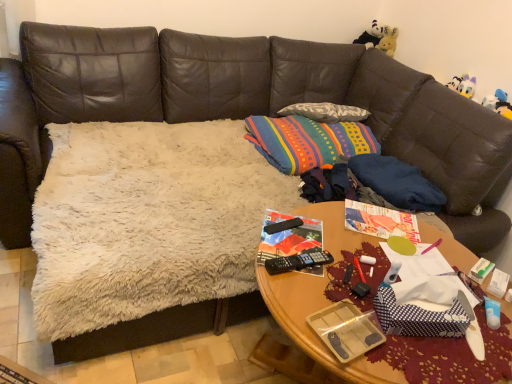
In order to face blue dotted paper at center, should I rotate leftwards or rightwards?

You should rotate right by 21.763 degrees.

Image resolution: width=512 pixels, height=384 pixels. I want to click on multicolored woven throw pillow at center, so click(x=307, y=141).

Between clear plastic tray at center and blue dotted paper at center, which one has smaller size?

Smaller between the two is clear plastic tray at center.

Which is behind, clear plastic tray at center or blue dotted paper at center?

blue dotted paper at center is more distant.

Looking at this image, between clear plastic tray at center and blue dotted paper at center, which one appears on the right side from the viewer's perspective?

blue dotted paper at center is more to the right.

I want to click on remote control above the multicolored woven throw pillow at center (from a real-world perspective), so click(283, 226).

From a real-world perspective, does multicolored woven throw pillow at center stand above black plastic remote control at center?

Actually, multicolored woven throw pillow at center is physically below black plastic remote control at center in the real world.

Is multicolored woven throw pillow at center looking in the opposite direction of black plastic remote control at center?

No.

In the scene shown: Is clear plastic tray at center far from plush white bear at upper right, acting as the first toy starting from the back?

clear plastic tray at center is far away from plush white bear at upper right, acting as the first toy starting from the back.

Considering the positions of point (376, 323) and point (388, 37), is point (376, 323) closer or farther from the camera than point (388, 37)?

Point (376, 323) appears to be closer to the viewer than point (388, 37).

From the image's perspective, which is below, clear plastic tray at center or plush white bear at upper right, acting as the first toy starting from the back?

From the image's view, clear plastic tray at center is below.

Which is more to the left, clear plastic tray at center or plush white bear at upper right, acting as the first toy starting from the back?

From the viewer's perspective, clear plastic tray at center appears more on the left side.

Considering the positions of objects woodenobject at center and black plastic remote control at center in the image provided, who is behind, woodenobject at center or black plastic remote control at center?

black plastic remote control at center.

Locate an element on the screen. table located below the black plastic remote control at center (from the image's perspective) is located at coordinates (311, 329).

Considering the positions of point (315, 308) and point (270, 232), is point (315, 308) closer or farther from the camera than point (270, 232)?

Point (315, 308) is positioned closer to the camera compared to point (270, 232).

Would you say woodenobject at center is to the left or to the right of black plastic remote control at center in the picture?

Based on their positions, woodenobject at center is located to the right of black plastic remote control at center.

Between woodenobject at center and clear plastic tray at center, which one has smaller size?

With smaller size is clear plastic tray at center.

Which object is further away from the camera taking this photo, woodenobject at center or clear plastic tray at center?

clear plastic tray at center.

Is woodenobject at center facing away from clear plastic tray at center?

woodenobject at center is not turned away from clear plastic tray at center.

Is the depth of black plastic remote control at center greater than that of clear plastic tray at center?

Yes, black plastic remote control at center is behind clear plastic tray at center.

Is black plastic remote control at center wider or thinner than clear plastic tray at center?

Clearly, black plastic remote control at center has less width compared to clear plastic tray at center.

Find the location of `package on the right of black plastic remote control at center`. package on the right of black plastic remote control at center is located at coordinates (347, 330).

Considering the relative sizes of black plastic remote control at center and blue dotted paper at center in the image provided, is black plastic remote control at center bigger than blue dotted paper at center?

Incorrect, black plastic remote control at center is not larger than blue dotted paper at center.

Considering the relative sizes of black plastic remote control at center and blue dotted paper at center in the image provided, is black plastic remote control at center wider than blue dotted paper at center?

Incorrect, the width of black plastic remote control at center does not surpass that of blue dotted paper at center.

Is black plastic remote control at center in front of or behind blue dotted paper at center in the image?

In the image, black plastic remote control at center appears behind blue dotted paper at center.

Can you tell me how much black plastic remote control at center and blue dotted paper at center differ in facing direction?

The angle between the facing direction of black plastic remote control at center and the facing direction of blue dotted paper at center is 25.2 degrees.

Locate an element on the screen. The width and height of the screenshot is (512, 384). package below the blue dotted paper at center (from the image's perspective) is located at coordinates (347, 330).

The image size is (512, 384). Identify the location of throw pillow behind the black plastic remote control at center. (307, 141).

Based on their spatial positions, is white plush duck at upper right, the second toy positioned from the top, or black plastic remote control at center closer to clear plastic tray at center?

The object closer to clear plastic tray at center is black plastic remote control at center.

Based on their spatial positions, is blue dotted paper at center or black plastic remote control at center further from clear plastic tray at center?

black plastic remote control at center lies further to clear plastic tray at center than the other object.

When comparing their distances from woodenobject at center, does plush white bear at upper right, acting as the first toy starting from the back, or blue dotted paper at center seem closer?

Among the two, blue dotted paper at center is located nearer to woodenobject at center.

Considering their positions, is black plastic remote control at center positioned further to clear plastic tray at center than plush white bear at upper right, acting as the first toy starting from the back?

plush white bear at upper right, acting as the first toy starting from the back, is positioned further to the anchor clear plastic tray at center.

When comparing their distances from black plastic remote control at center, does plush white bear at upper right, which ranks as the second toy in bottom-to-top order, or clear plastic tray at center seem closer?

Among the two, clear plastic tray at center is located nearer to black plastic remote control at center.

Which object lies further to the anchor point clear plastic tray at center, black plastic remote control at center or white plush duck at upper right, which appears as the 1th toy when viewed from the right?

white plush duck at upper right, which appears as the 1th toy when viewed from the right, is further to clear plastic tray at center.

Which object lies further to the anchor point plush white bear at upper right, the 1th toy from the left, multicolored woven throw pillow at center or woodenobject at center?

woodenobject at center is further to plush white bear at upper right, the 1th toy from the left.

From the image, which object appears to be farther from blue dotted paper at center, plush white bear at upper right, the 1th toy when ordered from top to bottom, or white plush duck at upper right, which is the 2th toy from left to right?

plush white bear at upper right, the 1th toy when ordered from top to bottom, is positioned further to the anchor blue dotted paper at center.

I want to click on remote control located between blue dotted paper at center and plush white bear at upper right, the 1th toy from the left, in the depth direction, so click(x=283, y=226).

You are a GUI agent. You are given a task and a screenshot of the screen. Output one action in this format:
    pyautogui.click(x=<x>, y=<y>)
    Task: Click on the throw pillow between blue dotted paper at center and white plush duck at upper right, which is the 2th toy from back to front, in the front-back direction
    This screenshot has width=512, height=384.
    Given the screenshot: What is the action you would take?
    pyautogui.click(x=307, y=141)

The width and height of the screenshot is (512, 384). Identify the location of remote control between clear plastic tray at center and multicolored woven throw pillow at center in the front-back direction. (283, 226).

Find the location of a particular element. The height and width of the screenshot is (384, 512). table located between clear plastic tray at center and blue dotted paper at center in the left-right direction is located at coordinates (311, 329).